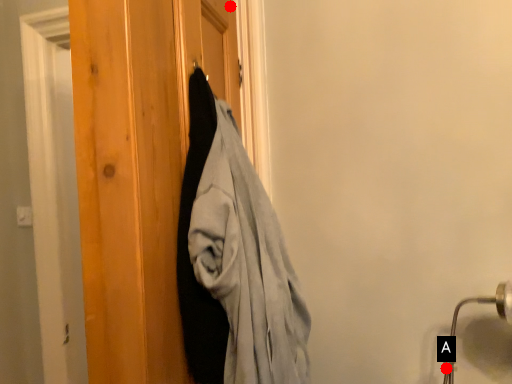
Question: Two points are circled on the image, labeled by A and B beside each circle. Which point is farther from the camera taking this photo?

Choices:
 (A) A is further
 (B) B is further

Answer: (B)